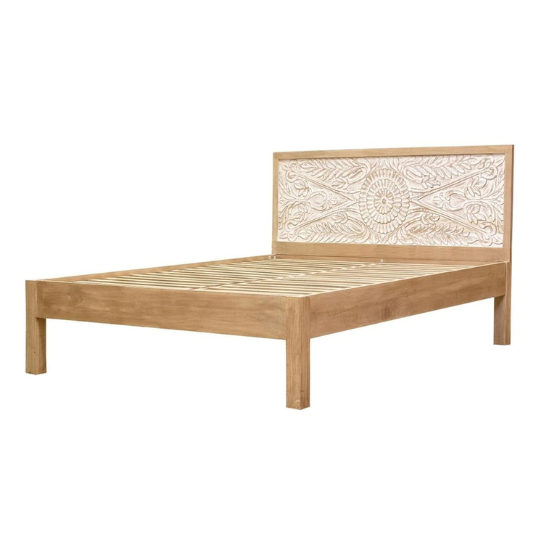
The width and height of the screenshot is (544, 544). Identify the location of back left bed leg. (503, 322).